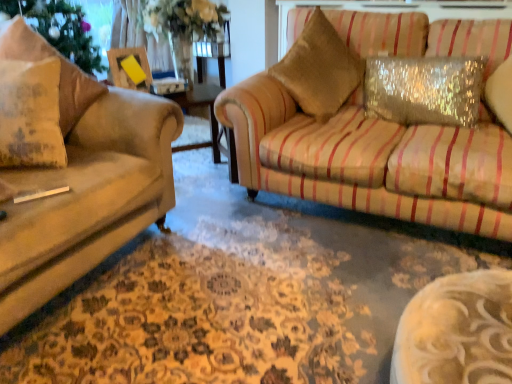
Measure the distance between sparkly silver pillow at upper right, which is the first pillow in right-to-left order, and camera.

sparkly silver pillow at upper right, which is the first pillow in right-to-left order, and camera are 1.89 meters apart.

Measure the distance between gold textured pillow at upper right and camera.

They are 6.70 feet apart.

I want to click on gold textured pillow at upper right, so click(x=319, y=69).

Find the location of a particular element. textured beige pillow at left, the 2th pillow positioned from the left is located at coordinates (60, 71).

Looking at this image, are textured beige pillow at left, the 2th pillow positioned from the left, and sparkly silver pillow at upper right, placed as the 3th pillow when sorted from left to right, far apart?

That's right, there is a large distance between textured beige pillow at left, the 2th pillow positioned from the left, and sparkly silver pillow at upper right, placed as the 3th pillow when sorted from left to right.

Considering the sizes of objects textured beige pillow at left, which is the second pillow in right-to-left order, and sparkly silver pillow at upper right, which is the first pillow in right-to-left order, in the image provided, who is wider, textured beige pillow at left, which is the second pillow in right-to-left order, or sparkly silver pillow at upper right, which is the first pillow in right-to-left order,?

With larger width is textured beige pillow at left, which is the second pillow in right-to-left order.

How different are the orientations of textured beige pillow at left, which is the second pillow in right-to-left order, and sparkly silver pillow at upper right, which is the first pillow in right-to-left order, in degrees?

They differ by 77.1 degrees in their facing directions.

Does textured beige pillow at left, the 2th pillow positioned from the left, appear on the right side of sparkly silver pillow at upper right, which is the first pillow in right-to-left order?

No.

From a real-world perspective, who is located higher, matte beige pillow at left, the 1th pillow viewed from the left, or gold textured pillow at upper right?

gold textured pillow at upper right.

From the picture: Who is taller, matte beige pillow at left, the third pillow in the right-to-left sequence, or gold textured pillow at upper right?

gold textured pillow at upper right is taller.

Which point is more distant from viewer, (47, 144) or (293, 59)?

Point (293, 59)

Locate an element on the screen. throw pillow behind the matte beige pillow at left, the third pillow in the right-to-left sequence is located at coordinates (319, 69).

From a real-world perspective, between matte beige pillow at left, the third pillow in the right-to-left sequence, and sparkly silver pillow at upper right, which is the first pillow in right-to-left order, who is vertically higher?

From a 3D spatial view, matte beige pillow at left, the third pillow in the right-to-left sequence, is above.

Does matte beige pillow at left, the 1th pillow viewed from the left, have a lesser width compared to sparkly silver pillow at upper right, which is the first pillow in right-to-left order?

No.

Considering their positions, is matte beige pillow at left, the 1th pillow viewed from the left, located in front of or behind sparkly silver pillow at upper right, which is the first pillow in right-to-left order?

In the image, matte beige pillow at left, the 1th pillow viewed from the left, appears in front of sparkly silver pillow at upper right, which is the first pillow in right-to-left order.

Would you say matte beige pillow at left, the third pillow in the right-to-left sequence, is inside or outside sparkly silver pillow at upper right, placed as the 3th pillow when sorted from left to right?

matte beige pillow at left, the third pillow in the right-to-left sequence, is located beyond the bounds of sparkly silver pillow at upper right, placed as the 3th pillow when sorted from left to right.

Is sparkly silver pillow at upper right, placed as the 3th pillow when sorted from left to right, smaller than textured beige pillow at left, the 2th pillow positioned from the left?

Yes.

From a real-world perspective, is sparkly silver pillow at upper right, placed as the 3th pillow when sorted from left to right, physically above textured beige pillow at left, the 2th pillow positioned from the left?

No, from a real-world perspective, sparkly silver pillow at upper right, placed as the 3th pillow when sorted from left to right, is not above textured beige pillow at left, the 2th pillow positioned from the left.

Is sparkly silver pillow at upper right, which is the first pillow in right-to-left order, facing away from textured beige pillow at left, which is the second pillow in right-to-left order?

No, textured beige pillow at left, which is the second pillow in right-to-left order, is not at the back of sparkly silver pillow at upper right, which is the first pillow in right-to-left order.

From the image's perspective, who appears lower, sparkly silver pillow at upper right, placed as the 3th pillow when sorted from left to right, or textured beige pillow at left, the 2th pillow positioned from the left?

textured beige pillow at left, the 2th pillow positioned from the left, is shown below in the image.

Is sparkly silver pillow at upper right, placed as the 3th pillow when sorted from left to right, looking in the opposite direction of gold textured pillow at upper right?

sparkly silver pillow at upper right, placed as the 3th pillow when sorted from left to right, is not turned away from gold textured pillow at upper right.

Locate an element on the screen. Image resolution: width=512 pixels, height=384 pixels. throw pillow behind the sparkly silver pillow at upper right, placed as the 3th pillow when sorted from left to right is located at coordinates (319, 69).

Who is more distant, gold textured pillow at upper right or matte beige pillow at left, the third pillow in the right-to-left sequence?

gold textured pillow at upper right is more distant.

There is a matte beige pillow at left, the third pillow in the right-to-left sequence. Where is `throw pillow above it (from a real-world perspective)`? The width and height of the screenshot is (512, 384). throw pillow above it (from a real-world perspective) is located at coordinates (319, 69).

Is gold textured pillow at upper right turned away from matte beige pillow at left, the 1th pillow viewed from the left?

No, gold textured pillow at upper right is not facing away from matte beige pillow at left, the 1th pillow viewed from the left.

Is matte beige pillow at left, the third pillow in the right-to-left sequence, a part of gold textured pillow at upper right?

No, matte beige pillow at left, the third pillow in the right-to-left sequence, is not a part of gold textured pillow at upper right.

Is textured beige pillow at left, which is the second pillow in right-to-left order, taller or shorter than matte beige pillow at left, the third pillow in the right-to-left sequence?

Clearly, textured beige pillow at left, which is the second pillow in right-to-left order, is taller compared to matte beige pillow at left, the third pillow in the right-to-left sequence.

Starting from the matte beige pillow at left, the 1th pillow viewed from the left, which pillow is the 1st one to the right? Please provide its 2D coordinates.

[(60, 71)]

Based on their positions, is textured beige pillow at left, which is the second pillow in right-to-left order, located to the left or right of matte beige pillow at left, the third pillow in the right-to-left sequence?

In the image, textured beige pillow at left, which is the second pillow in right-to-left order, appears on the right side of matte beige pillow at left, the third pillow in the right-to-left sequence.

From the image's perspective, would you say textured beige pillow at left, which is the second pillow in right-to-left order, is positioned over matte beige pillow at left, the 1th pillow viewed from the left?

Correct, textured beige pillow at left, which is the second pillow in right-to-left order, appears higher than matte beige pillow at left, the 1th pillow viewed from the left, in the image.

From a real-world perspective, which pillow is the 2nd one underneath the textured beige pillow at left, which is the second pillow in right-to-left order? Please provide its 2D coordinates.

[(424, 90)]

Locate an element on the screen. This screenshot has width=512, height=384. throw pillow behind the matte beige pillow at left, the third pillow in the right-to-left sequence is located at coordinates (319, 69).

From the picture: Estimate the real-world distances between objects in this image. Which object is further from matte beige pillow at left, the 1th pillow viewed from the left, gold textured pillow at upper right or sparkly silver pillow at upper right, placed as the 3th pillow when sorted from left to right?

Based on the image, sparkly silver pillow at upper right, placed as the 3th pillow when sorted from left to right, appears to be further to matte beige pillow at left, the 1th pillow viewed from the left.

In the scene shown: Based on their spatial positions, is sparkly silver pillow at upper right, which is the first pillow in right-to-left order, or matte beige pillow at left, the 1th pillow viewed from the left, closer to gold textured pillow at upper right?

sparkly silver pillow at upper right, which is the first pillow in right-to-left order, lies closer to gold textured pillow at upper right than the other object.

Which object lies further to the anchor point matte beige pillow at left, the 1th pillow viewed from the left, sparkly silver pillow at upper right, placed as the 3th pillow when sorted from left to right, or gold textured pillow at upper right?

sparkly silver pillow at upper right, placed as the 3th pillow when sorted from left to right.

Estimate the real-world distances between objects in this image. Which object is further from sparkly silver pillow at upper right, which is the first pillow in right-to-left order, gold textured pillow at upper right or matte beige pillow at left, the third pillow in the right-to-left sequence?

matte beige pillow at left, the third pillow in the right-to-left sequence, lies further to sparkly silver pillow at upper right, which is the first pillow in right-to-left order, than the other object.

Which object lies further to the anchor point matte beige pillow at left, the 1th pillow viewed from the left, textured beige pillow at left, which is the second pillow in right-to-left order, or gold textured pillow at upper right?

gold textured pillow at upper right.

From the picture: Which object lies nearer to the anchor point sparkly silver pillow at upper right, placed as the 3th pillow when sorted from left to right, gold textured pillow at upper right or textured beige pillow at left, the 2th pillow positioned from the left?

The object closer to sparkly silver pillow at upper right, placed as the 3th pillow when sorted from left to right, is gold textured pillow at upper right.

Estimate the real-world distances between objects in this image. Which object is further from gold textured pillow at upper right, textured beige pillow at left, the 2th pillow positioned from the left, or sparkly silver pillow at upper right, which is the first pillow in right-to-left order?

The object further to gold textured pillow at upper right is textured beige pillow at left, the 2th pillow positioned from the left.

Which object lies nearer to the anchor point gold textured pillow at upper right, textured beige pillow at left, the 2th pillow positioned from the left, or matte beige pillow at left, the 1th pillow viewed from the left?

Based on the image, textured beige pillow at left, the 2th pillow positioned from the left, appears to be nearer to gold textured pillow at upper right.

Identify the location of throw pillow located between matte beige pillow at left, the 1th pillow viewed from the left, and sparkly silver pillow at upper right, placed as the 3th pillow when sorted from left to right, in the left-right direction. (319, 69).

Find the location of a particular element. pillow between matte beige pillow at left, the third pillow in the right-to-left sequence, and sparkly silver pillow at upper right, which is the first pillow in right-to-left order, from left to right is located at coordinates (60, 71).

I want to click on throw pillow located between textured beige pillow at left, which is the second pillow in right-to-left order, and sparkly silver pillow at upper right, placed as the 3th pillow when sorted from left to right, in the left-right direction, so click(319, 69).

In order to click on pillow between matte beige pillow at left, the 1th pillow viewed from the left, and gold textured pillow at upper right, in the horizontal direction in this screenshot , I will do `click(60, 71)`.